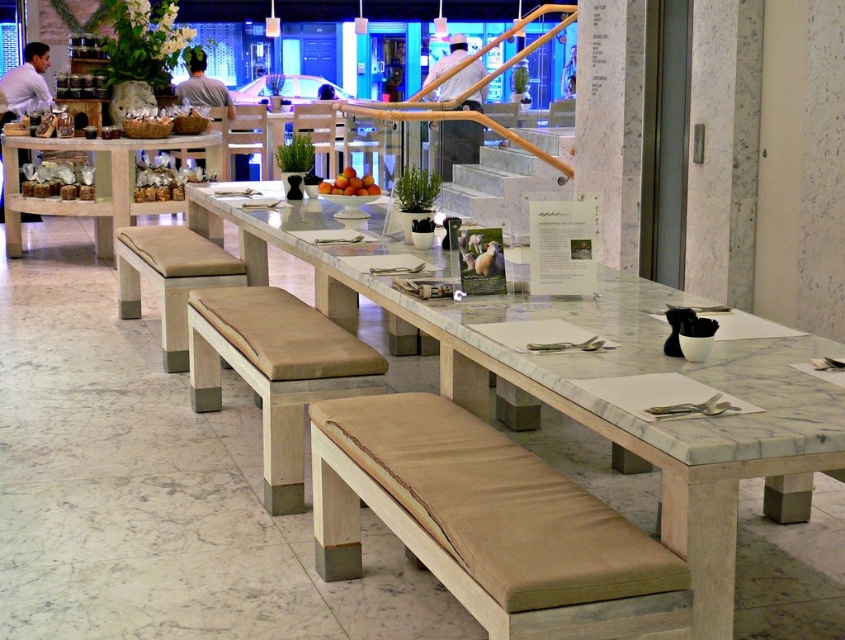
Is beige fabric bench at lower left thinner than orange matte fruit at center?

In fact, beige fabric bench at lower left might be wider than orange matte fruit at center.

What do you see at coordinates (170, 278) in the screenshot? This screenshot has height=640, width=845. I see `beige fabric bench at lower left` at bounding box center [170, 278].

The width and height of the screenshot is (845, 640). Identify the location of beige fabric bench at lower left. (170, 278).

Who is positioned more to the right, brown fabric bench at center or orange matte fruit at center?

brown fabric bench at center is more to the right.

From the picture: Can you confirm if brown fabric bench at center is positioned below orange matte fruit at center?

Yes.

Is point (644, 580) farther from camera compared to point (345, 168)?

No, (644, 580) is closer to viewer.

At what (x,y) coordinates should I click in order to perform the action: click on brown fabric bench at center. Please return your answer as a coordinate pair (x, y). Image resolution: width=845 pixels, height=640 pixels. Looking at the image, I should click on (488, 524).

Does white marble table at center have a lesser height compared to beige fabric bench at lower left?

Incorrect, white marble table at center's height does not fall short of beige fabric bench at lower left's.

Is white marble table at center thinner than beige fabric bench at lower left?

Incorrect, white marble table at center's width is not less than beige fabric bench at lower left's.

Who is more forward, (500, 316) or (128, 259)?

Positioned in front is point (500, 316).

Where is `white marble table at center`? white marble table at center is located at coordinates (595, 378).